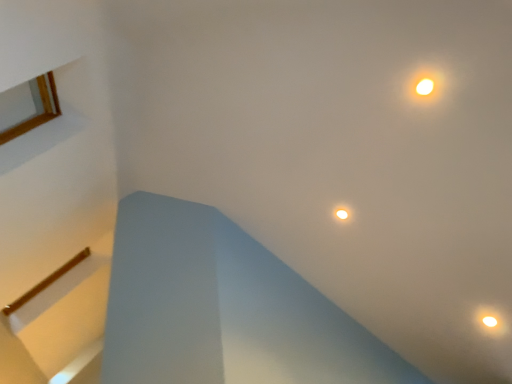
Image resolution: width=512 pixels, height=384 pixels. What do you see at coordinates (342, 213) in the screenshot?
I see `matte gold droplight at center, which is counted as the second droplight, starting from the bottom` at bounding box center [342, 213].

Measure the distance between point (423, 86) and camera.

Point (423, 86) is 1.87 meters from camera.

Describe the element at coordinates (490, 321) in the screenshot. The image size is (512, 384). I see `matte white droplight at lower right, which is the first droplight from bottom to top` at that location.

I want to click on matte white droplight at lower right, the second droplight positioned from the back, so click(490, 321).

This screenshot has height=384, width=512. Find the location of `matte gold droplight at center, which is counted as the second droplight, starting from the front`. matte gold droplight at center, which is counted as the second droplight, starting from the front is located at coordinates (342, 213).

Is matte gold droplight at center, which is the 1th droplight from top to bottom, positioned with its back to matte yellow light at upper right?

No, matte yellow light at upper right is not at the back of matte gold droplight at center, which is the 1th droplight from top to bottom.

Is matte gold droplight at center, which is the 1th droplight from top to bottom, inside or outside of matte yellow light at upper right?

matte gold droplight at center, which is the 1th droplight from top to bottom, lies outside matte yellow light at upper right.

Based on their positions, is matte gold droplight at center, which is counted as the 1th droplight, starting from the back, located to the left or right of matte yellow light at upper right?

matte gold droplight at center, which is counted as the 1th droplight, starting from the back, is to the left of matte yellow light at upper right.

Which is more to the left, matte yellow light at upper right or matte gold droplight at center, which appears as the 2th droplight when viewed from the right?

From the viewer's perspective, matte gold droplight at center, which appears as the 2th droplight when viewed from the right, appears more on the left side.

Is matte yellow light at upper right inside or outside of matte gold droplight at center, which is counted as the 1th droplight, starting from the back?

matte yellow light at upper right is spatially situated outside matte gold droplight at center, which is counted as the 1th droplight, starting from the back.

Is matte yellow light at upper right facing away from matte gold droplight at center, which ranks as the 1th droplight in left-to-right order?

That's not correct — matte yellow light at upper right is not looking away from matte gold droplight at center, which ranks as the 1th droplight in left-to-right order.

In terms of height, does matte yellow light at upper right look taller or shorter compared to matte gold droplight at center, which is counted as the 1th droplight, starting from the back?

In the image, matte yellow light at upper right appears to be taller than matte gold droplight at center, which is counted as the 1th droplight, starting from the back.

From a real-world perspective, is matte white droplight at lower right, placed as the 1th droplight when sorted from front to back, physically above matte yellow light at upper right?

No, from a real-world perspective, matte white droplight at lower right, placed as the 1th droplight when sorted from front to back, is not on top of matte yellow light at upper right.

Considering the relative sizes of matte white droplight at lower right, positioned as the second droplight in left-to-right order, and matte yellow light at upper right in the image provided, is matte white droplight at lower right, positioned as the second droplight in left-to-right order, wider than matte yellow light at upper right?

Yes, matte white droplight at lower right, positioned as the second droplight in left-to-right order, is wider than matte yellow light at upper right.

Considering the relative positions of matte white droplight at lower right, placed as the 1th droplight when sorted from front to back, and matte yellow light at upper right in the image provided, is matte white droplight at lower right, placed as the 1th droplight when sorted from front to back, to the right of matte yellow light at upper right from the viewer's perspective?

Yes.

Is matte white droplight at lower right, the second droplight positioned from the back, not close to matte yellow light at upper right?

Yes, matte white droplight at lower right, the second droplight positioned from the back, is far from matte yellow light at upper right.

I want to click on droplight below the matte gold droplight at center, which ranks as the 1th droplight in left-to-right order (from the image's perspective), so click(x=490, y=321).

Would you say matte gold droplight at center, which is the 1th droplight from top to bottom, is inside or outside matte white droplight at lower right, positioned as the second droplight in left-to-right order?

matte gold droplight at center, which is the 1th droplight from top to bottom, is located beyond the bounds of matte white droplight at lower right, positioned as the second droplight in left-to-right order.

Can you tell me how much matte gold droplight at center, which is counted as the second droplight, starting from the bottom, and matte white droplight at lower right, the second droplight positioned from the top, differ in facing direction?

There is a 1.89-degree angle between the facing directions of matte gold droplight at center, which is counted as the second droplight, starting from the bottom, and matte white droplight at lower right, the second droplight positioned from the top.

Between matte gold droplight at center, which is the 1th droplight from top to bottom, and matte white droplight at lower right, the second droplight positioned from the back, which one has more height?

matte gold droplight at center, which is the 1th droplight from top to bottom, is taller.

Is the depth of matte yellow light at upper right greater than that of matte white droplight at lower right, the second droplight positioned from the back?

No, matte yellow light at upper right is closer to the camera.

Is point (413, 90) farther from camera compared to point (485, 324)?

That is False.

From the image's perspective, between matte yellow light at upper right and matte white droplight at lower right, which ranks as the 1th droplight in right-to-left order, which one is located above?

matte yellow light at upper right appears higher in the image.

Identify the location of light above the matte white droplight at lower right, which is the first droplight from bottom to top (from a real-world perspective). The image size is (512, 384). (425, 86).

Is matte white droplight at lower right, the second droplight positioned from the top, completely or partially outside of matte gold droplight at center, which appears as the 2th droplight when viewed from the right?

Yes, matte white droplight at lower right, the second droplight positioned from the top, is outside of matte gold droplight at center, which appears as the 2th droplight when viewed from the right.

From the image's perspective, is matte white droplight at lower right, which ranks as the 1th droplight in right-to-left order, on matte gold droplight at center, which is counted as the second droplight, starting from the bottom?

No, from the image's perspective, matte white droplight at lower right, which ranks as the 1th droplight in right-to-left order, is not above matte gold droplight at center, which is counted as the second droplight, starting from the bottom.

How many degrees apart are the facing directions of matte white droplight at lower right, which is the first droplight from bottom to top, and matte gold droplight at center, which is counted as the second droplight, starting from the bottom?

The facing directions of matte white droplight at lower right, which is the first droplight from bottom to top, and matte gold droplight at center, which is counted as the second droplight, starting from the bottom, are 1.89 degrees apart.

Is point (489, 324) positioned behind point (342, 213)?

No.

You are a GUI agent. You are given a task and a screenshot of the screen. Output one action in this format:
    pyautogui.click(x=<x>, y=<y>)
    Task: Click on the light that appears in front of the matte gold droplight at center, which ranks as the 1th droplight in left-to-right order
    
    Given the screenshot: What is the action you would take?
    pyautogui.click(x=425, y=86)

This screenshot has width=512, height=384. There is a matte yellow light at upper right. In order to click on the 1st droplight below it (from a real-world perspective) in this screenshot , I will do `click(342, 213)`.

Which object lies nearer to the anchor point matte yellow light at upper right, matte white droplight at lower right, the second droplight positioned from the top, or matte gold droplight at center, which is counted as the second droplight, starting from the front?

matte gold droplight at center, which is counted as the second droplight, starting from the front, is closer to matte yellow light at upper right.

Based on their spatial positions, is matte gold droplight at center, which is the 1th droplight from top to bottom, or matte white droplight at lower right, positioned as the second droplight in left-to-right order, closer to matte yellow light at upper right?

matte gold droplight at center, which is the 1th droplight from top to bottom, is closer to matte yellow light at upper right.

Based on their spatial positions, is matte yellow light at upper right or matte white droplight at lower right, positioned as the second droplight in left-to-right order, closer to matte gold droplight at center, which is counted as the second droplight, starting from the front?

The object closer to matte gold droplight at center, which is counted as the second droplight, starting from the front, is matte yellow light at upper right.

Which object lies further to the anchor point matte white droplight at lower right, placed as the 1th droplight when sorted from front to back, matte yellow light at upper right or matte gold droplight at center, which is counted as the second droplight, starting from the front?

The object further to matte white droplight at lower right, placed as the 1th droplight when sorted from front to back, is matte yellow light at upper right.

Considering their positions, is matte white droplight at lower right, the second droplight positioned from the back, positioned closer to matte gold droplight at center, which is counted as the second droplight, starting from the bottom, than matte yellow light at upper right?

The object closer to matte gold droplight at center, which is counted as the second droplight, starting from the bottom, is matte yellow light at upper right.

Considering their positions, is matte gold droplight at center, which ranks as the 1th droplight in left-to-right order, positioned closer to matte white droplight at lower right, which ranks as the 1th droplight in right-to-left order, than matte yellow light at upper right?

matte gold droplight at center, which ranks as the 1th droplight in left-to-right order, is closer to matte white droplight at lower right, which ranks as the 1th droplight in right-to-left order.

At what (x,y) coordinates should I click in order to perform the action: click on droplight between matte yellow light at upper right and matte white droplight at lower right, positioned as the second droplight in left-to-right order, from top to bottom. Please return your answer as a coordinate pair (x, y). The image size is (512, 384). Looking at the image, I should click on (342, 213).